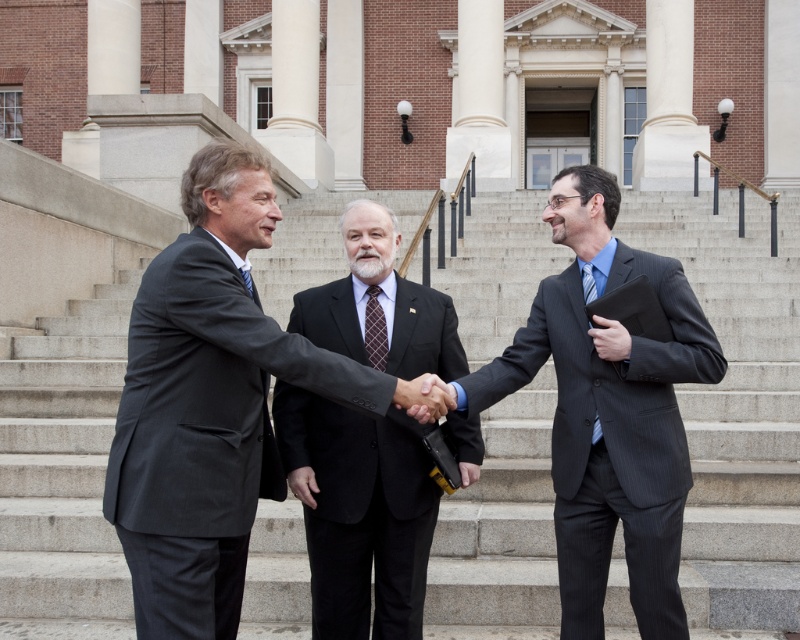
Is the position of smooth black hand at center more distant than that of dark blue textured tie at center?

No, it is not.

Where is `smooth black hand at center`? smooth black hand at center is located at coordinates (424, 397).

The image size is (800, 640). What do you see at coordinates (424, 397) in the screenshot? I see `smooth black hand at center` at bounding box center [424, 397].

Where is `smooth black hand at center`? The height and width of the screenshot is (640, 800). smooth black hand at center is located at coordinates 424,397.

Does matte black suit at center have a smaller size compared to dark gray pinstripe suit at center?

Correct, matte black suit at center occupies less space than dark gray pinstripe suit at center.

Which is in front, point (242, 259) or point (588, 397)?

Point (242, 259)

Locate an element on the screen. The image size is (800, 640). matte black suit at center is located at coordinates (208, 404).

Which is below, dark brown textured tie at center or dark blue textured tie at center?

dark brown textured tie at center is lower down.

Is point (380, 346) positioned before point (245, 273)?

No.

Where is `dark brown textured tie at center`? dark brown textured tie at center is located at coordinates (376, 330).